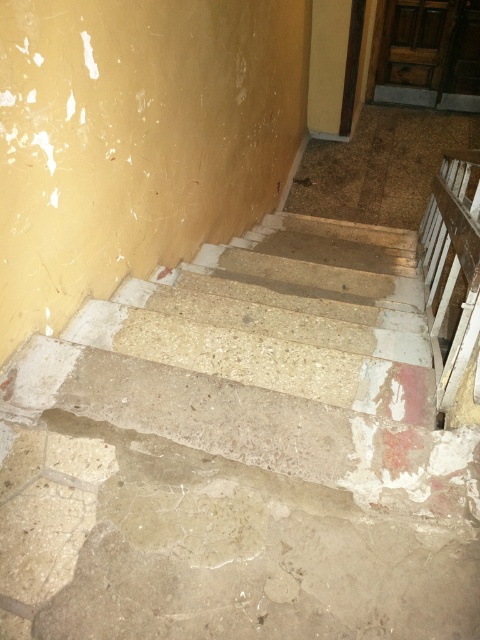
Question: Which point is closer to the camera?

Choices:
 (A) (453, 240)
 (B) (276, 436)

Answer: (B)

Question: Where is concrete stairs at center located in relation to white wooden rail at right in the image?

Choices:
 (A) below
 (B) above

Answer: (A)

Question: Is concrete stairs at center positioned at the back of white wooden rail at right?

Choices:
 (A) yes
 (B) no

Answer: (B)

Question: Can you confirm if concrete stairs at center is wider than white wooden rail at right?

Choices:
 (A) yes
 (B) no

Answer: (A)